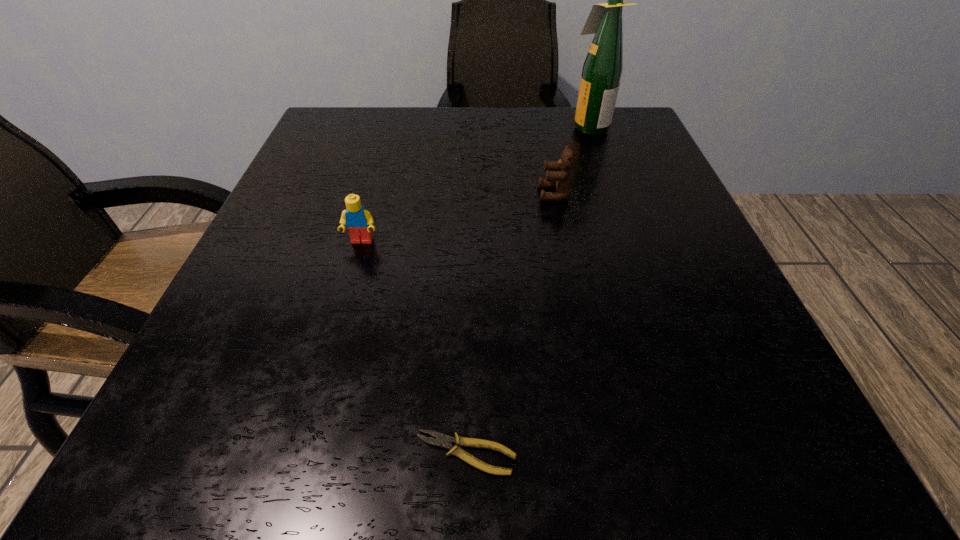
Locate an element on the screen. The height and width of the screenshot is (540, 960). free point located 0.390m on the front-facing side of the liquor is located at coordinates (398, 127).

This screenshot has width=960, height=540. In order to click on free space located 0.280m on the face of the second object from right to left in this screenshot , I will do `click(390, 193)`.

Image resolution: width=960 pixels, height=540 pixels. What are the coordinates of `free space located 0.050m on the face of the second object from right to left` in the screenshot? It's located at (513, 193).

Locate an element on the screen. The width and height of the screenshot is (960, 540). free space located on the face of the second object from right to left is located at coordinates (348, 193).

Find the location of `free location located on the front-facing side of the leftmost object`. free location located on the front-facing side of the leftmost object is located at coordinates (352, 274).

The image size is (960, 540). In order to click on vacant space located 0.270m on the right of the nearest object in this screenshot , I will do `click(760, 454)`.

Identify the location of object that is at the far edge. (603, 66).

In order to click on object that is at the near edge in this screenshot , I will do `click(443, 441)`.

At what (x,y) coordinates should I click in order to perform the action: click on object present at the left edge. Please return your answer as a coordinate pair (x, y). Looking at the image, I should click on (358, 220).

Locate an element on the screen. object located in the right edge section of the desktop is located at coordinates (603, 66).